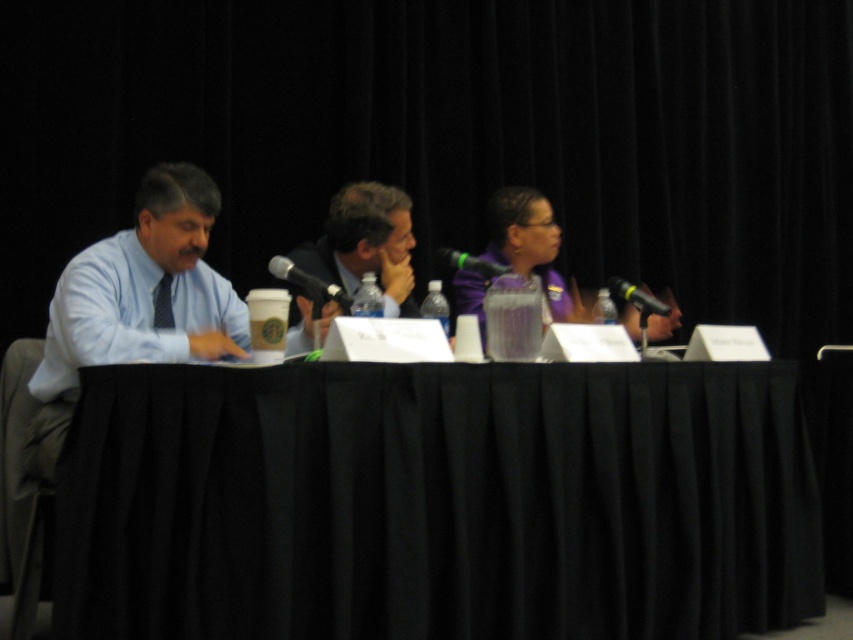
Who is positioned more to the right, matte blue dress shirt at left or black plastic microphone at right?

Positioned to the right is black plastic microphone at right.

From the picture: Can you confirm if matte blue dress shirt at left is positioned to the left of black plastic microphone at right?

Indeed, matte blue dress shirt at left is positioned on the left side of black plastic microphone at right.

The width and height of the screenshot is (853, 640). In order to click on matte blue dress shirt at left in this screenshot , I will do `click(129, 314)`.

Which of these two, matte blue dress shirt at left or black plastic microphone at center, stands taller?

With more height is matte blue dress shirt at left.

Which is above, matte blue dress shirt at left or black plastic microphone at center?

black plastic microphone at center is above.

Locate an element on the screen. Image resolution: width=853 pixels, height=640 pixels. matte blue dress shirt at left is located at coordinates (129, 314).

Is black fabric table at center to the right of black plastic microphone at center from the viewer's perspective?

Indeed, black fabric table at center is positioned on the right side of black plastic microphone at center.

Which is above, black fabric table at center or black plastic microphone at center?

Positioned higher is black plastic microphone at center.

Locate an element on the screen. This screenshot has height=640, width=853. black fabric table at center is located at coordinates (437, 502).

Where is `black fabric table at center`? The width and height of the screenshot is (853, 640). black fabric table at center is located at coordinates click(x=437, y=502).